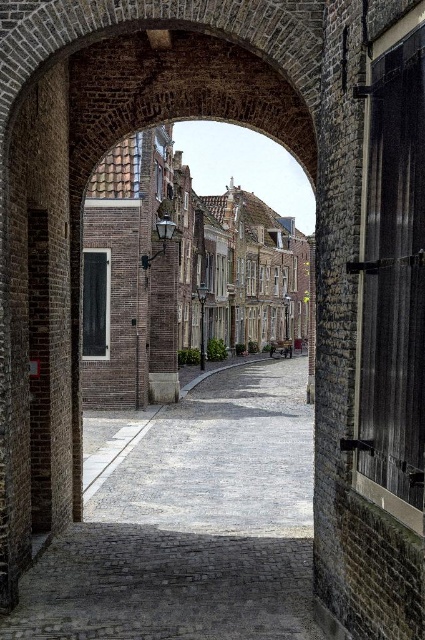
Measure the distance from gray cobblestone alley at center to brick building at center.

gray cobblestone alley at center is 19.81 meters from brick building at center.

Which is below, gray cobblestone alley at center or brick building at center?

gray cobblestone alley at center

Who is more distant from viewer, (258, 406) or (149, 182)?

Point (258, 406)

Identify the location of gray cobblestone alley at center. Image resolution: width=425 pixels, height=640 pixels. (187, 520).